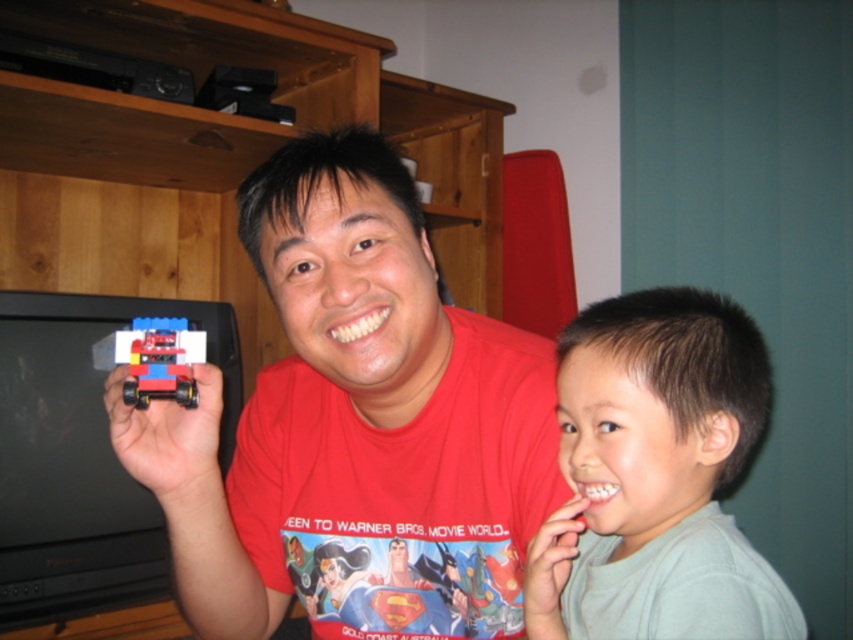
Does point (398, 557) come closer to viewer compared to point (157, 380)?

No, it is not.

Which is in front, point (267, 192) or point (167, 332)?

Point (167, 332) is in front.

Image resolution: width=853 pixels, height=640 pixels. Describe the element at coordinates (355, 426) in the screenshot. I see `matte plastic toy car at left` at that location.

The width and height of the screenshot is (853, 640). In order to click on matte plastic toy car at left in this screenshot , I will do `click(355, 426)`.

Which of these two, matte plastic toy car at left or light gray cotton shirt at right, stands shorter?

light gray cotton shirt at right

Is matte plastic toy car at left positioned behind light gray cotton shirt at right?

Yes, it is.

Which is in front, point (445, 481) or point (631, 502)?

Point (631, 502) is in front.

Locate an element on the screen. This screenshot has width=853, height=640. matte plastic toy car at left is located at coordinates (355, 426).

Is point (595, 608) closer to camera compared to point (181, 348)?

Yes, point (595, 608) is closer to viewer.

The height and width of the screenshot is (640, 853). What are the coordinates of `light gray cotton shirt at right` in the screenshot? It's located at (656, 476).